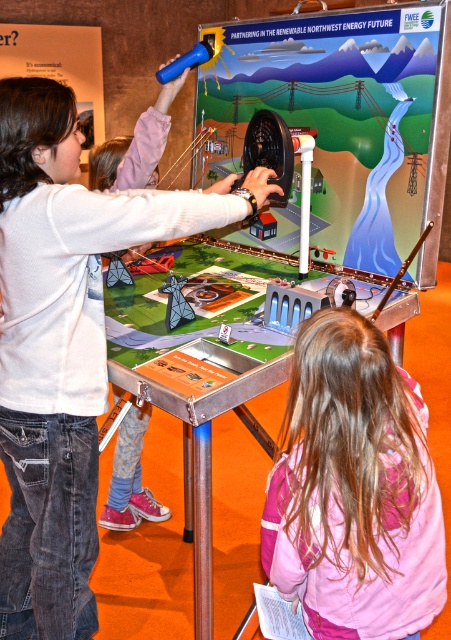
What do you see at coordinates (64, 346) in the screenshot? I see `white matte shirt at upper left` at bounding box center [64, 346].

How much distance is there between white matte shirt at upper left and matte white shirt at upper left?

The distance of white matte shirt at upper left from matte white shirt at upper left is 81.20 centimeters.

Who is more distant from viewer, (68, 372) or (128, 184)?

The point (128, 184) is behind.

Where is `white matte shirt at upper left`? This screenshot has width=451, height=640. white matte shirt at upper left is located at coordinates (64, 346).

Can you confirm if pink fabric hair at upper center is positioned below matte white shirt at upper left?

Indeed, pink fabric hair at upper center is positioned under matte white shirt at upper left.

Is pink fabric hair at upper center taller than matte white shirt at upper left?

Yes, pink fabric hair at upper center is taller than matte white shirt at upper left.

Is point (400, 589) less distant than point (93, 160)?

Yes, point (400, 589) is closer to viewer.

Identify the location of pink fabric hair at upper center. This screenshot has height=640, width=451. (354, 490).

Which is more to the right, white matte shirt at upper left or pink fabric hair at upper center?

Positioned to the right is pink fabric hair at upper center.

Does point (55, 193) come farther from viewer compared to point (391, 362)?

Yes, point (55, 193) is farther from viewer.

What are the coordinates of `white matte shirt at upper left` in the screenshot? It's located at (64, 346).